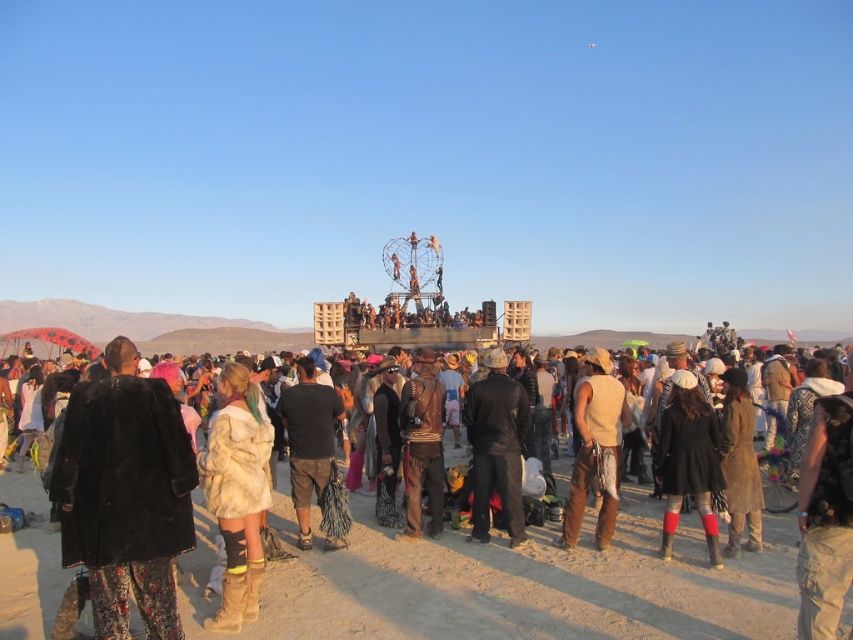
Question: Which point appears closest to the camera in this image?

Choices:
 (A) (503, 426)
 (B) (585, 356)

Answer: (A)

Question: Does fuzzy black coat at lower left have a smaller size compared to tan leather vest at center?

Choices:
 (A) yes
 (B) no

Answer: (B)

Question: Which object is positioned farthest from the brown leather vest at center?

Choices:
 (A) tan leather vest at center
 (B) black leather boots at lower right
 (C) fuzzy beige coat at center
 (D) black cotton shorts at center

Answer: (B)

Question: Can you confirm if black leather jacket at center is positioned to the left of tan leather vest at center?

Choices:
 (A) yes
 (B) no

Answer: (A)

Question: Can you confirm if fuzzy beige coat at center is positioned to the left of black leather jacket at center?

Choices:
 (A) no
 (B) yes

Answer: (B)

Question: Which point is farther from the camera taking this photo?

Choices:
 (A) (490, 490)
 (B) (666, 531)

Answer: (A)